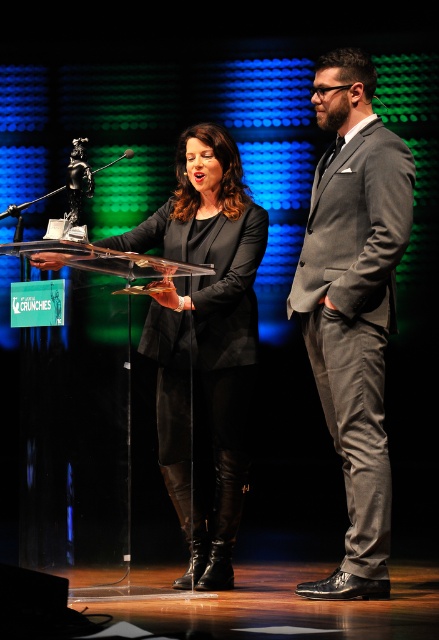
You are standing at the center of the stage in the awards ceremony scene. You need to walk to the gray suit at right. Which direction should you move in order to reach it?

The gray suit at right is located at point 0.475 on the x axis and 0.806 on the y axis. Since you are at the center, moving towards the right and slightly forward would lead you to the gray suit at right.

You are a photographer at the event and need to adjust the camera focus. The gray suit at right and the matte black dress at center are both in the frame. Which one should you focus on if you want to capture the taller individual?

The gray suit at right is much taller than the matte black dress at center, so you should focus on the gray suit at right to capture the taller individual.